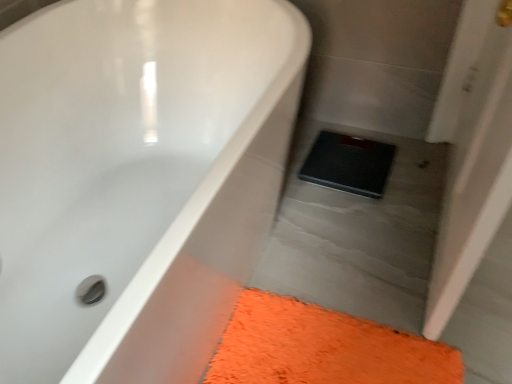
The width and height of the screenshot is (512, 384). What are the coordinates of `vacant location behind black rubber scale at center` in the screenshot? It's located at (336, 130).